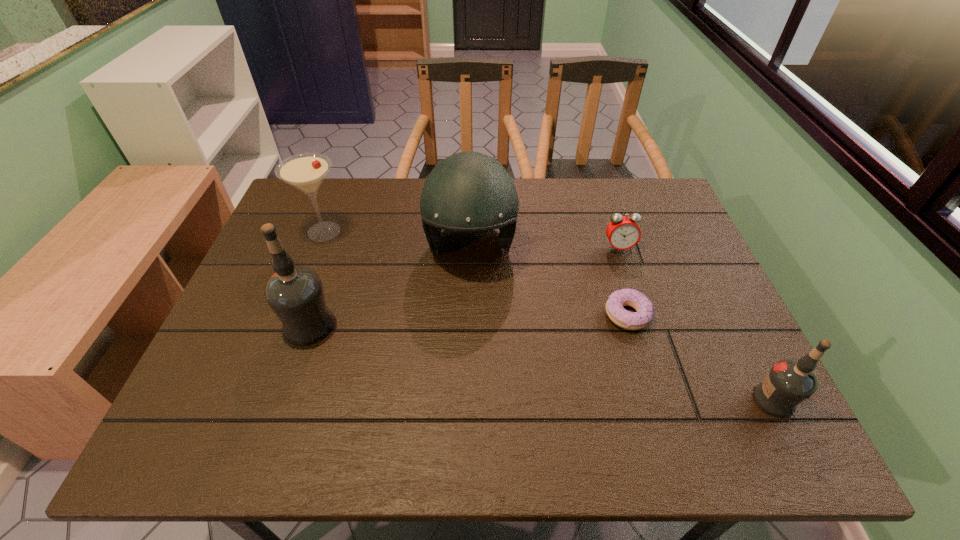
Identify the location of the farther vodka. This screenshot has height=540, width=960. (295, 294).

Find the location of a particular element. Image resolution: width=960 pixels, height=540 pixels. the taller vodka is located at coordinates (295, 294).

You are a GUI agent. You are given a task and a screenshot of the screen. Output one action in this format:
    pyautogui.click(x=<x>, y=<y>)
    Task: Click on the nearest object
    
    Given the screenshot: What is the action you would take?
    pyautogui.click(x=788, y=383)

Locate an element on the screen. the nearer vodka is located at coordinates (788, 383).

The image size is (960, 540). I want to click on football helmet, so click(x=468, y=192).

The image size is (960, 540). What are the coordinates of `the second shortest object` in the screenshot? It's located at (623, 233).

Where is `martini`? The image size is (960, 540). martini is located at coordinates (306, 171).

In order to click on doughnut in this screenshot , I will do `click(618, 299)`.

The image size is (960, 540). Find the location of `vacant space situated 0.090m on the front label of the taller vodka`. vacant space situated 0.090m on the front label of the taller vodka is located at coordinates (246, 325).

Find the location of `free location located 0.100m on the front label of the taller vodka`. free location located 0.100m on the front label of the taller vodka is located at coordinates click(242, 325).